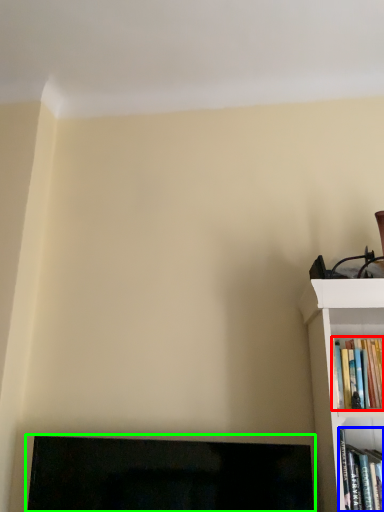
Question: Considering the real-world distances, which object is closest to book (highlighted by a red box)? book (highlighted by a blue box) or fireplace (highlighted by a green box).

Choices:
 (A) book
 (B) fireplace

Answer: (A)